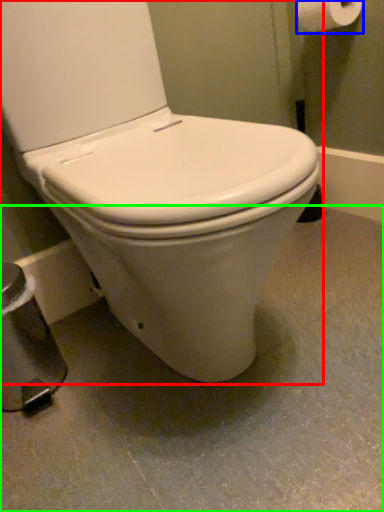
Question: Estimate the real-world distances between objects in this image. Which object is farther from toilet (highlighted by a red box), toilet paper (highlighted by a blue box) or concrete (highlighted by a green box)?

Choices:
 (A) toilet paper
 (B) concrete

Answer: (A)